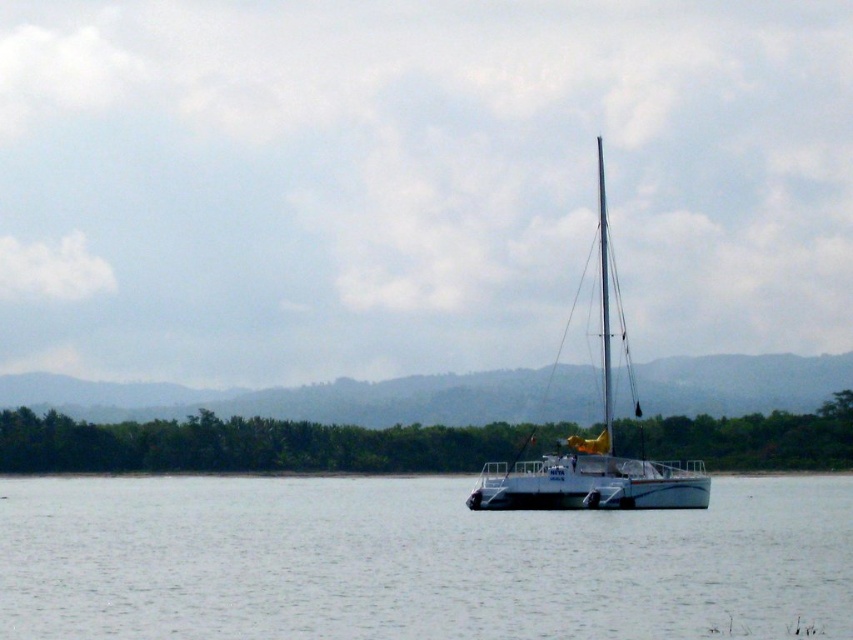
Question: Does clear water at center come behind white matte sailboat at center?

Choices:
 (A) yes
 (B) no

Answer: (B)

Question: Among these objects, which one is farthest from the camera?

Choices:
 (A) white matte sailboat at center
 (B) clear water at center

Answer: (A)

Question: Which point appears farthest from the camera in this image?

Choices:
 (A) (529, 493)
 (B) (482, 625)

Answer: (A)

Question: Is clear water at center closer to the viewer compared to white matte sailboat at center?

Choices:
 (A) yes
 (B) no

Answer: (A)

Question: Is clear water at center smaller than white matte sailboat at center?

Choices:
 (A) yes
 (B) no

Answer: (A)